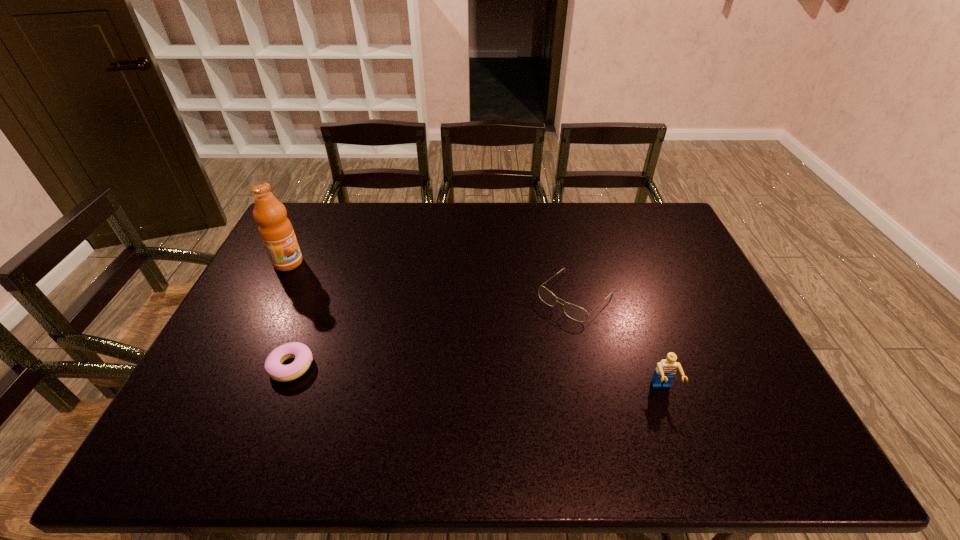
The height and width of the screenshot is (540, 960). Find the location of `free space at the far edge`. free space at the far edge is located at coordinates (569, 202).

Where is `vacant space at the near edge`? vacant space at the near edge is located at coordinates (x=663, y=399).

Locate an element on the screen. This screenshot has width=960, height=540. blank space at the left edge of the desktop is located at coordinates (236, 319).

Locate an element on the screen. The width and height of the screenshot is (960, 540). vacant space at the right edge is located at coordinates (686, 265).

At what (x,y) coordinates should I click in order to perform the action: click on vacant region at the far left corner of the desktop. Please return your answer as a coordinate pair (x, y). Looking at the image, I should click on (322, 233).

In the image, there is a desktop. In order to click on free space at the near right corner in this screenshot , I will do `click(719, 394)`.

This screenshot has height=540, width=960. In order to click on empty space between the rightmost object and the doughnut in this screenshot , I will do tap(477, 378).

Locate an element on the screen. empty location between the third tallest object and the tallest object is located at coordinates (x=431, y=280).

At what (x,y) coordinates should I click in order to perform the action: click on vacant area between the shortest object and the third object from left to right. Please return your answer as a coordinate pair (x, y). Looking at the image, I should click on (433, 332).

Identify the location of free space that is in between the shortest object and the leftmost object. (290, 315).